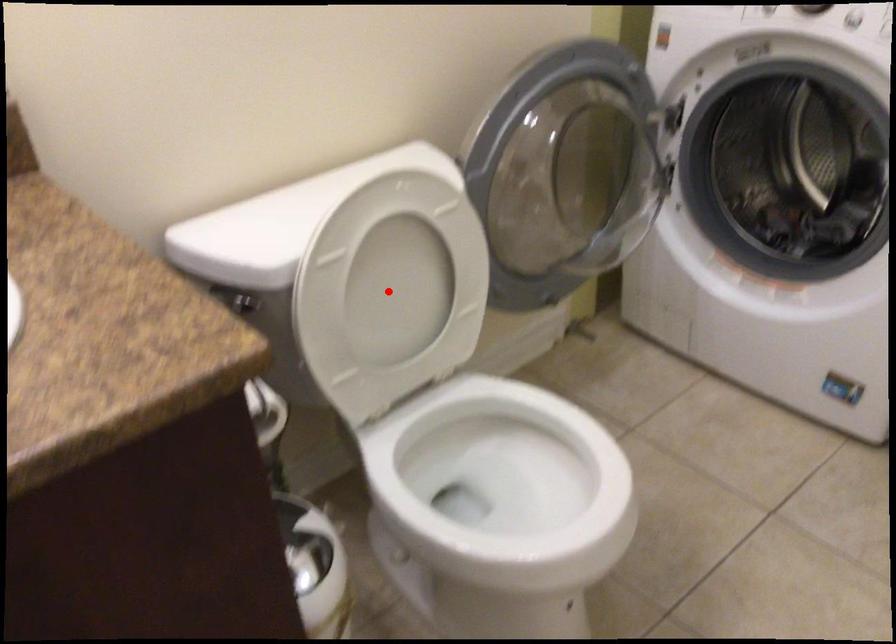
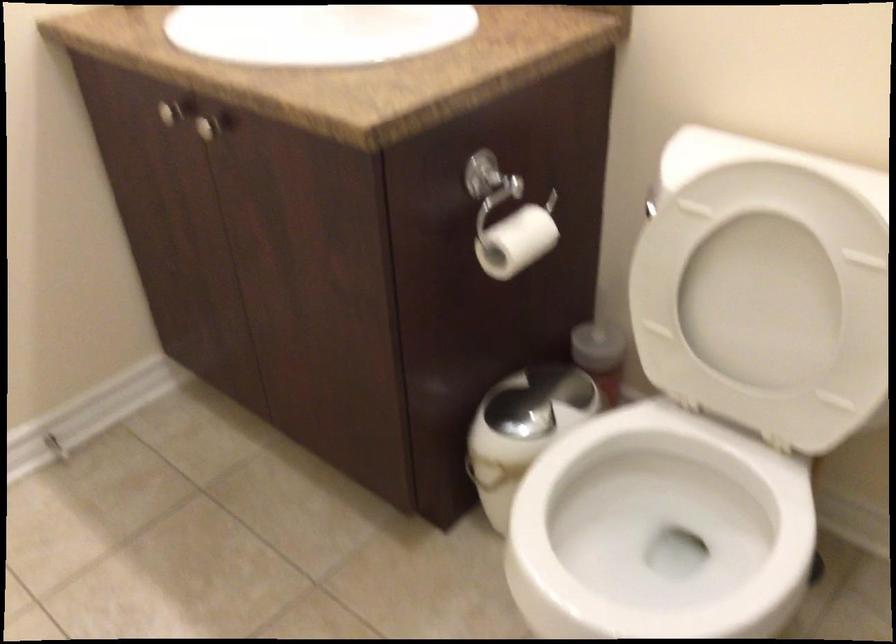
Where in the second image is the point corresponding to the highlighted location from the first image?

(763, 299)